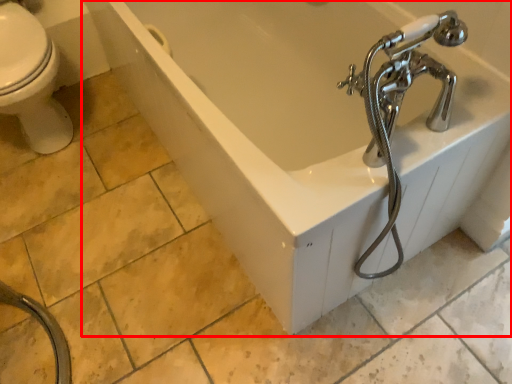
Question: From the image's perspective, where is bathtub (annotated by the red box) located in relation to garden hose in the image?

Choices:
 (A) above
 (B) below

Answer: (A)